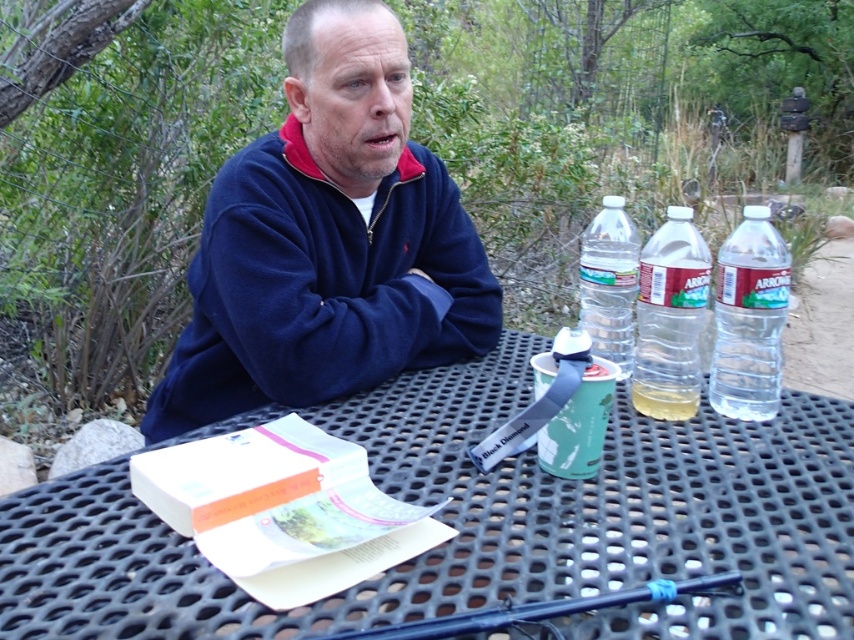
Question: Which point appears farthest from the camera in this image?

Choices:
 (A) (676, 538)
 (B) (611, 225)

Answer: (B)

Question: Considering the real-world distances, which object is closest to the translucent plastic bottle at right?

Choices:
 (A) translucent plastic cup at center
 (B) clear plastic bottle at right
 (C) black metal table at center

Answer: (B)

Question: Can you confirm if black metal table at center is positioned above translucent plastic cup at center?

Choices:
 (A) yes
 (B) no

Answer: (B)

Question: Does translucent plastic bottle at right appear under translucent plastic cup at center?

Choices:
 (A) no
 (B) yes

Answer: (A)

Question: Does black metal table at center have a lesser width compared to translucent plastic cup at center?

Choices:
 (A) no
 (B) yes

Answer: (A)

Question: Based on their relative distances, which object is farther from the translucent plastic bottle at right?

Choices:
 (A) clear plastic bottle at right
 (B) black metal table at center
 (C) clear plastic water bottle at upper right

Answer: (B)